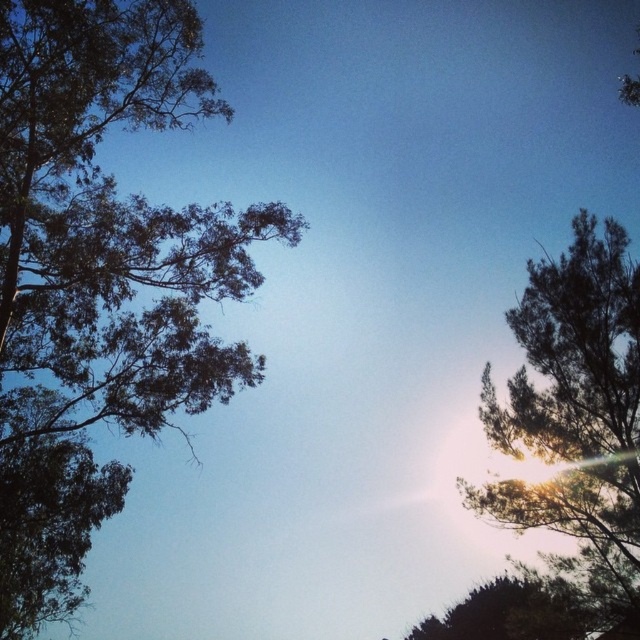
Question: From the image, what is the correct spatial relationship of green leafy tree at upper left in relation to dark green leafy tree at upper right?

Choices:
 (A) left
 (B) right

Answer: (A)

Question: Which of the following is the closest to the observer?

Choices:
 (A) (625, 593)
 (B) (84, 342)

Answer: (B)

Question: Does green leafy tree at upper left appear under dark green leafy tree at upper right?

Choices:
 (A) yes
 (B) no

Answer: (B)

Question: Does green leafy tree at upper left have a larger size compared to dark green leafy tree at upper right?

Choices:
 (A) no
 (B) yes

Answer: (B)